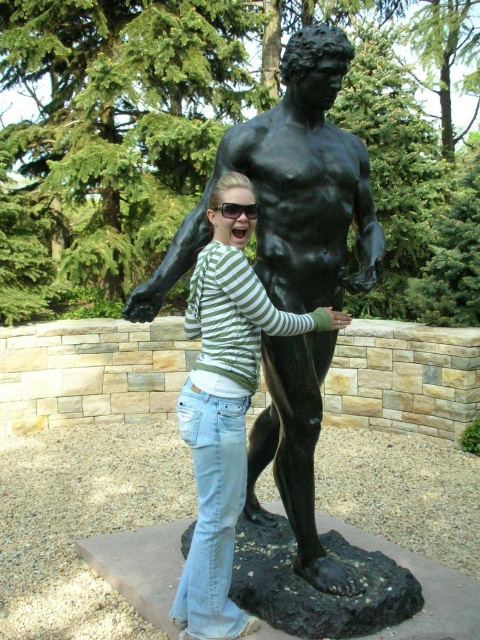
Question: Which of the following is the closest to the observer?

Choices:
 (A) click(194, 477)
 (B) click(336, 32)

Answer: (B)

Question: Is black matte statue at center smaller than green striped shirt at center?

Choices:
 (A) yes
 (B) no

Answer: (B)

Question: Does black matte statue at center have a lesser width compared to green striped shirt at center?

Choices:
 (A) yes
 (B) no

Answer: (B)

Question: Which is nearer to the black plastic goggles at center?

Choices:
 (A) green striped shirt at center
 (B) black matte statue at center

Answer: (B)

Question: Which point is farther to the camera?

Choices:
 (A) (236, 212)
 (B) (343, 291)

Answer: (B)

Question: Is green striped shirt at center above black plastic goggles at center?

Choices:
 (A) yes
 (B) no

Answer: (B)